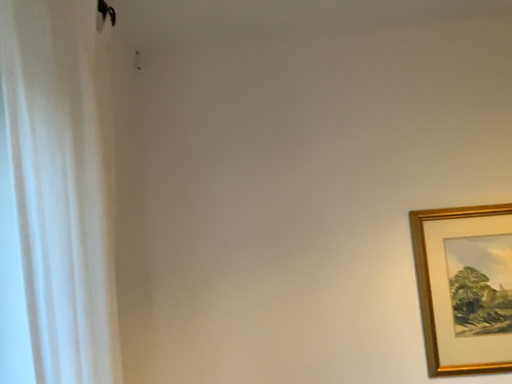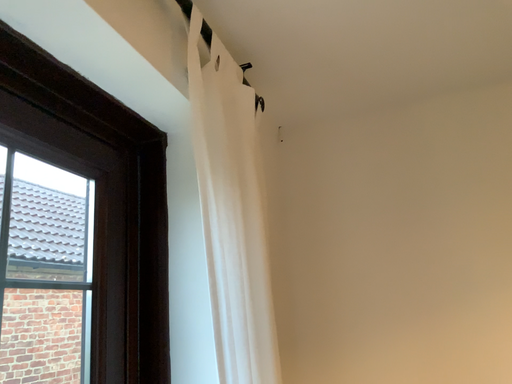
Question: Which way did the camera rotate in the video?

Choices:
 (A) rotated right
 (B) rotated left

Answer: (B)